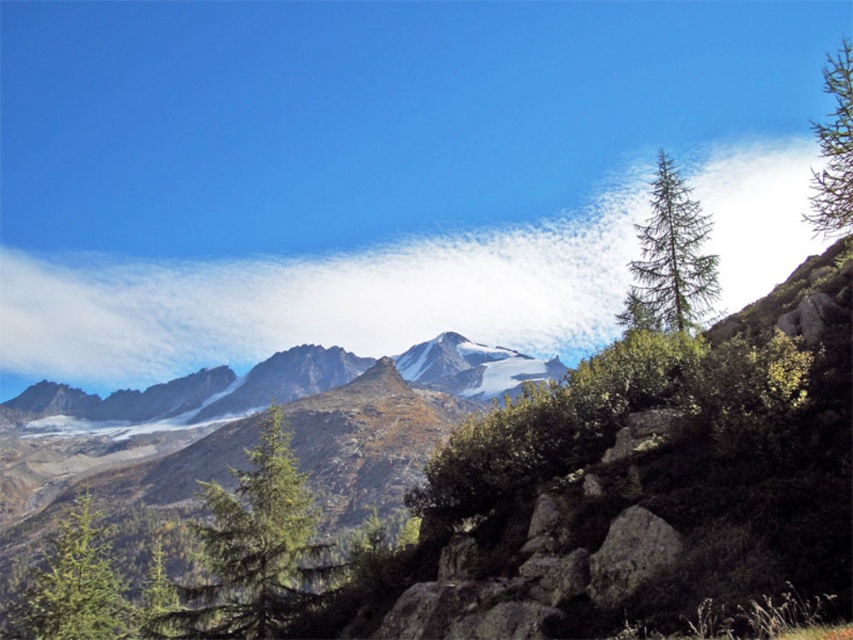
Question: From the image, what is the correct spatial relationship of green needle-like tree at right in relation to green matte tree at upper right?

Choices:
 (A) above
 (B) below

Answer: (B)

Question: Can you confirm if green matte tree at lower left is thinner than green matte tree at upper right?

Choices:
 (A) no
 (B) yes

Answer: (B)

Question: Estimate the real-world distances between objects in this image. Which object is farther from the white fluffy cloud at upper center?

Choices:
 (A) green needle-like tree at right
 (B) green matte tree at upper right
 (C) green matte tree at lower left

Answer: (C)

Question: Is the position of green needle-like tree at center-left more distant than that of green needle-like tree at right?

Choices:
 (A) yes
 (B) no

Answer: (B)

Question: Which of the following is the closest to the observer?

Choices:
 (A) (61, 598)
 (B) (834, 209)

Answer: (A)

Question: Which point appears closest to the camera in this image?

Choices:
 (A) (654, 168)
 (B) (636, 212)
 (C) (828, 211)
 (D) (193, 531)

Answer: (D)